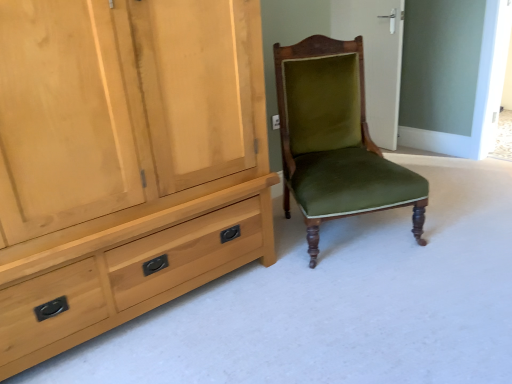
Question: From a real-world perspective, is velvet green chair at center physically above green velvet chair at center?

Choices:
 (A) no
 (B) yes

Answer: (A)

Question: Considering the relative sizes of velvet green chair at center and green velvet chair at center in the image provided, is velvet green chair at center shorter than green velvet chair at center?

Choices:
 (A) no
 (B) yes

Answer: (B)

Question: From a real-world perspective, is velvet green chair at center located beneath green velvet chair at center?

Choices:
 (A) yes
 (B) no

Answer: (A)

Question: Considering the relative sizes of velvet green chair at center and green velvet chair at center in the image provided, is velvet green chair at center smaller than green velvet chair at center?

Choices:
 (A) no
 (B) yes

Answer: (A)

Question: Is velvet green chair at center positioned far away from green velvet chair at center?

Choices:
 (A) no
 (B) yes

Answer: (B)

Question: Could you tell me if velvet green chair at center is turned towards green velvet chair at center?

Choices:
 (A) no
 (B) yes

Answer: (A)

Question: Is velvet green chair at center at the back of green velvet chair at center?

Choices:
 (A) yes
 (B) no

Answer: (B)

Question: Can you confirm if green velvet chair at center is smaller than velvet green chair at center?

Choices:
 (A) no
 (B) yes

Answer: (B)

Question: Can you see green velvet chair at center touching velvet green chair at center?

Choices:
 (A) yes
 (B) no

Answer: (B)

Question: Is green velvet chair at center wider than velvet green chair at center?

Choices:
 (A) yes
 (B) no

Answer: (B)

Question: Does green velvet chair at center turn towards velvet green chair at center?

Choices:
 (A) yes
 (B) no

Answer: (B)

Question: From the image's perspective, is green velvet chair at center beneath velvet green chair at center?

Choices:
 (A) no
 (B) yes

Answer: (A)

Question: Is velvet green chair at center at the back of light wood cabinet at left?

Choices:
 (A) yes
 (B) no

Answer: (B)